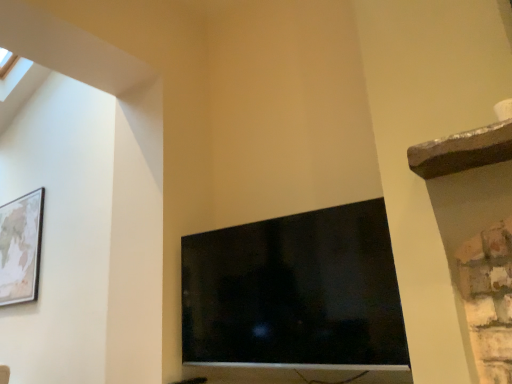
Locate an element on the screen. The image size is (512, 384). black glossy tv at center is located at coordinates (295, 291).

The width and height of the screenshot is (512, 384). What do you see at coordinates (295, 291) in the screenshot? I see `black glossy tv at center` at bounding box center [295, 291].

What do you see at coordinates (21, 248) in the screenshot? I see `wooden framed map at upper left` at bounding box center [21, 248].

Identify the location of wooden framed map at upper left. point(21,248).

The width and height of the screenshot is (512, 384). What are the coordinates of `black glossy tv at center` in the screenshot? It's located at (295, 291).

Visually, is wooden framed map at upper left positioned to the left or to the right of black glossy tv at center?

wooden framed map at upper left is to the left of black glossy tv at center.

Is wooden framed map at upper left further to camera compared to black glossy tv at center?

That is True.

Is point (0, 260) closer or farther from the camera than point (372, 357)?

Clearly, point (0, 260) is more distant from the camera than point (372, 357).

From the image's perspective, is wooden framed map at upper left located above or below black glossy tv at center?

Based on their image positions, wooden framed map at upper left is located above black glossy tv at center.

From a real-world perspective, is wooden framed map at upper left over black glossy tv at center?

Yes.

Looking at their sizes, would you say wooden framed map at upper left is wider or thinner than black glossy tv at center?

wooden framed map at upper left is thinner than black glossy tv at center.

Considering the relative sizes of wooden framed map at upper left and black glossy tv at center in the image provided, is wooden framed map at upper left shorter than black glossy tv at center?

No.

Considering the relative sizes of wooden framed map at upper left and black glossy tv at center in the image provided, is wooden framed map at upper left bigger than black glossy tv at center?

No, wooden framed map at upper left is not bigger than black glossy tv at center.

Is wooden framed map at upper left situated inside black glossy tv at center or outside?

wooden framed map at upper left is outside black glossy tv at center.

Is wooden framed map at upper left next to black glossy tv at center and touching it?

No, wooden framed map at upper left is not beside black glossy tv at center.

Is wooden framed map at upper left facing away from black glossy tv at center?

That's not correct — wooden framed map at upper left is not looking away from black glossy tv at center.

Locate an element on the screen. The width and height of the screenshot is (512, 384). television in front of the wooden framed map at upper left is located at coordinates (295, 291).

In the scene shown: Which is more to the right, black glossy tv at center or wooden framed map at upper left?

Positioned to the right is black glossy tv at center.

Is the depth of black glossy tv at center less than that of wooden framed map at upper left?

Yes, black glossy tv at center is in front of wooden framed map at upper left.

Considering the points (205, 252) and (23, 268), which point is behind, point (205, 252) or point (23, 268)?

Positioned behind is point (23, 268).

From the image's perspective, between black glossy tv at center and wooden framed map at upper left, which one is located above?

From the image's view, wooden framed map at upper left is above.

From a real-world perspective, is black glossy tv at center on wooden framed map at upper left?

No.

Considering the relative sizes of black glossy tv at center and wooden framed map at upper left in the image provided, is black glossy tv at center wider than wooden framed map at upper left?

Yes, black glossy tv at center is wider than wooden framed map at upper left.

In the scene shown: Considering the sizes of black glossy tv at center and wooden framed map at upper left in the image, is black glossy tv at center taller or shorter than wooden framed map at upper left?

Clearly, black glossy tv at center is shorter compared to wooden framed map at upper left.

Is black glossy tv at center smaller than wooden framed map at upper left?

No.

Is black glossy tv at center spatially inside wooden framed map at upper left, or outside of it?

black glossy tv at center lies outside wooden framed map at upper left.

Is black glossy tv at center positioned far away from wooden framed map at upper left?

black glossy tv at center is positioned a significant distance from wooden framed map at upper left.

Based on the photo, is wooden framed map at upper left at the back of black glossy tv at center?

No, black glossy tv at center is not facing away from wooden framed map at upper left.

Can you tell me how much black glossy tv at center and wooden framed map at upper left differ in facing direction?

There is a 0.299-degree angle between the facing directions of black glossy tv at center and wooden framed map at upper left.

I want to click on television that is in front of the wooden framed map at upper left, so click(295, 291).

What are the coordinates of `picture frame on the left of black glossy tv at center` in the screenshot? It's located at (21, 248).

The width and height of the screenshot is (512, 384). What are the coordinates of `television lying in front of the wooden framed map at upper left` in the screenshot? It's located at (295, 291).